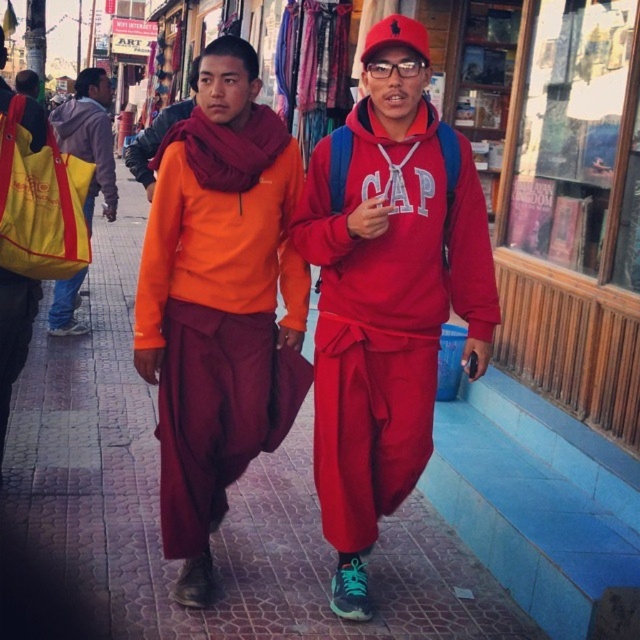
In the scene shown: You are a customer in the market looking for a bag to carry your purchases. You see the matte orange sweater at center and the yellow fabric bag at left. Which item is taller?

The matte orange sweater at center is taller than the yellow fabric bag at left.

You are standing at the point labeled as point (387, 292) in the image. Looking around, you see a matte orange sweater at center. What object is located at the point you are standing on?

The point labeled as point (387, 292) is where the matte orange sweater at center is located.

You are a store clerk in a clothing store and need to hang two robes, the maroon cotton robe at center and the red cotton robe at center, on a rack. According to the image, which robe should be placed below the other?

The maroon cotton robe at center should be placed below the red cotton robe at center because the maroon cotton robe at center is positioned under red cotton robe at center in the image.